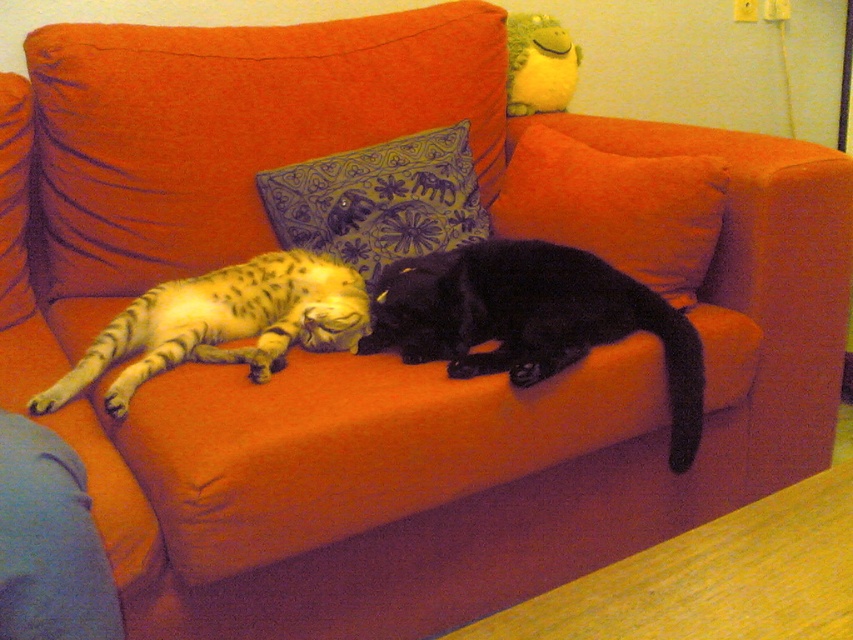
Consider the image. You are a photographer trying to capture a clear photo of the orange fabric pillow at center. However, the tabby fur cat at center is blocking the view. Can you move the cat to the side so the pillow is visible? Explain why or why not based on their positions.

The tabby fur cat at center is in front of the orange fabric pillow at center, so moving the cat to the side would allow the pillow to be visible.

You are a cat owner who wants to place a small toy between the orange fabric pillow at center and the blue embroidered pillow at center on the sofa. Since the cats like to play with toys that are not too high off the ground, which pillow should you place the toy closer to?

The blue embroidered pillow at center is shorter in height than the orange fabric pillow at center. To ensure the toy is closer to the ground, place it near the blue embroidered pillow at center.

You are trying to place a new rectangular cushion on the sofa between the tabby fur cat at center and the orange fabric pillow at center. Based on their current positions, which object is wider so that the cushion can fit between them?

The tabby fur cat at center is wider than the orange fabric pillow at center, so the cushion can be placed between them by aligning it with the cat.